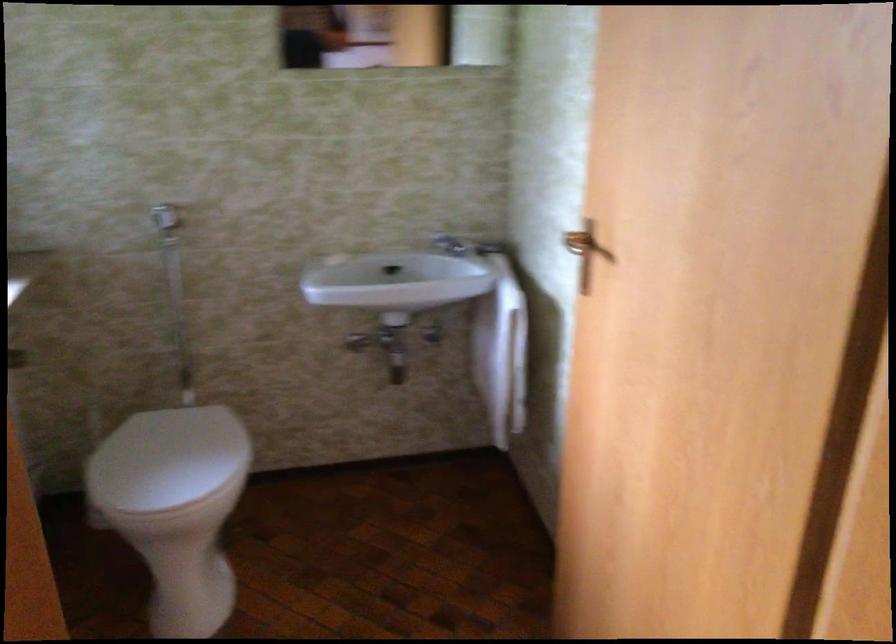
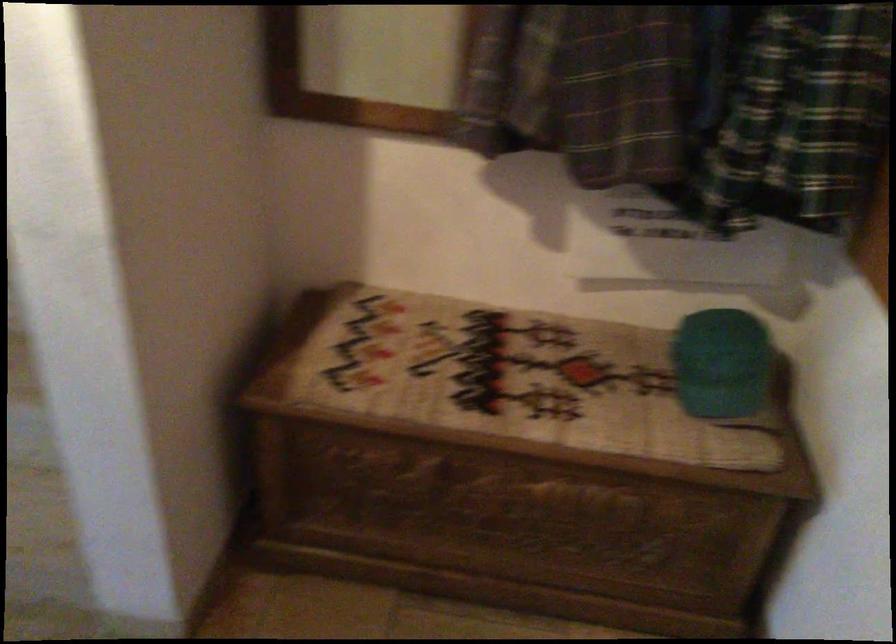
Question: What movement of the cameraman would produce the second image?

Choices:
 (A) Left
 (B) Right
 (C) Forward
 (D) Backward

Answer: (B)